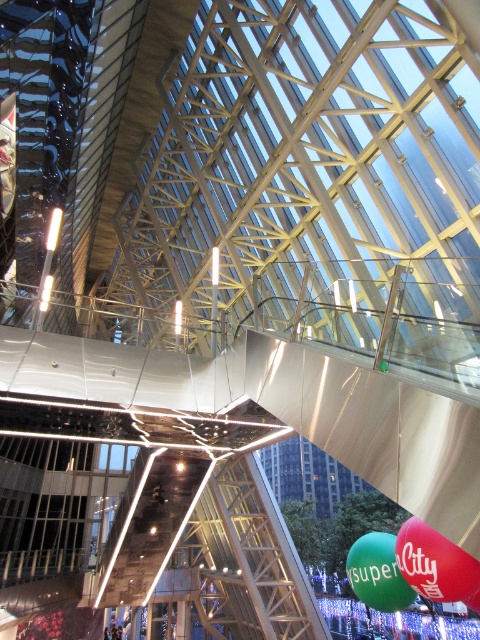
Question: Can you confirm if matte red balloon at lower right is positioned above green rubber balloon at lower right?

Choices:
 (A) yes
 (B) no

Answer: (A)

Question: Among these points, which one is nearest to the camera?

Choices:
 (A) (397, 547)
 (B) (400, 596)

Answer: (A)

Question: Can you confirm if matte red balloon at lower right is wider than green rubber balloon at lower right?

Choices:
 (A) no
 (B) yes

Answer: (A)

Question: Is matte red balloon at lower right to the left of green rubber balloon at lower right from the viewer's perspective?

Choices:
 (A) no
 (B) yes

Answer: (A)

Question: Which object appears farthest from the camera in this image?

Choices:
 (A) matte red balloon at lower right
 (B) green rubber balloon at lower right

Answer: (B)